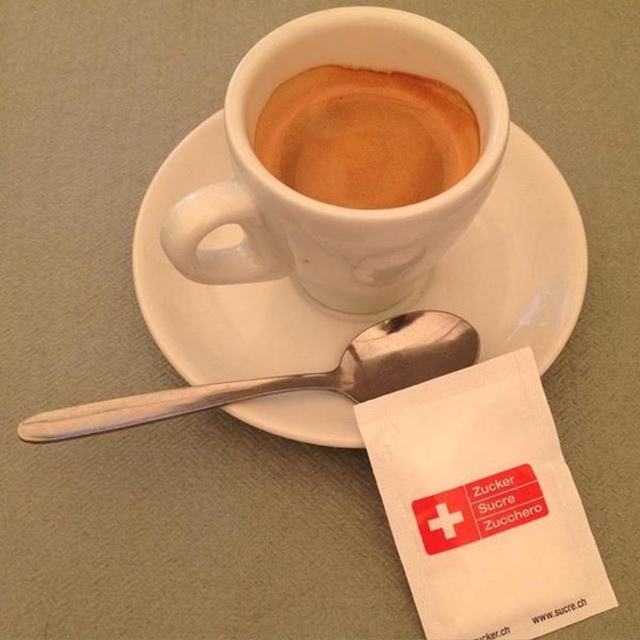
You are setting up a table for a coffee shop and need to ensure that the brown matte cup at center and the silver metallic spoon at center fit within a 15 cm wide space. Based on their sizes, will both items fit side by side without overlapping?

The brown matte cup at center has a lesser width compared to the silver metallic spoon at center. However, since the spoon is wider, the combined width of both items might exceed 15 cm. To determine if they fit, you need to know the exact widths of each item. The given information only states the cup is narrower than the spoon, but not their specific measurements.

You are a barista preparing a drink and need to place a sugar packet between the white ceramic saucer at upper center and the silver metallic spoon at center. Can you fit it there?

The distance between the white ceramic saucer at upper center and the silver metallic spoon at center is 4.77 inches. If the sugar packet requires less than this space, it can fit.